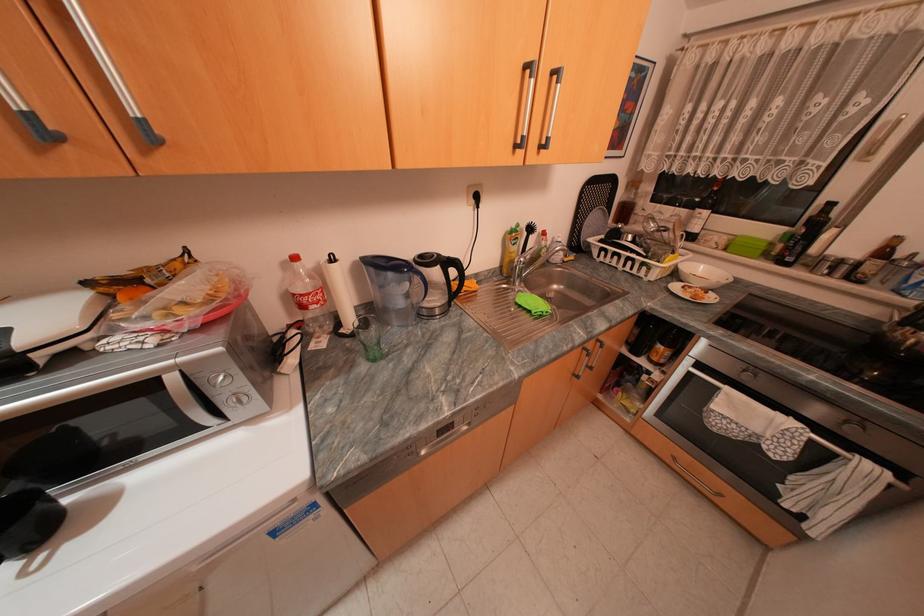
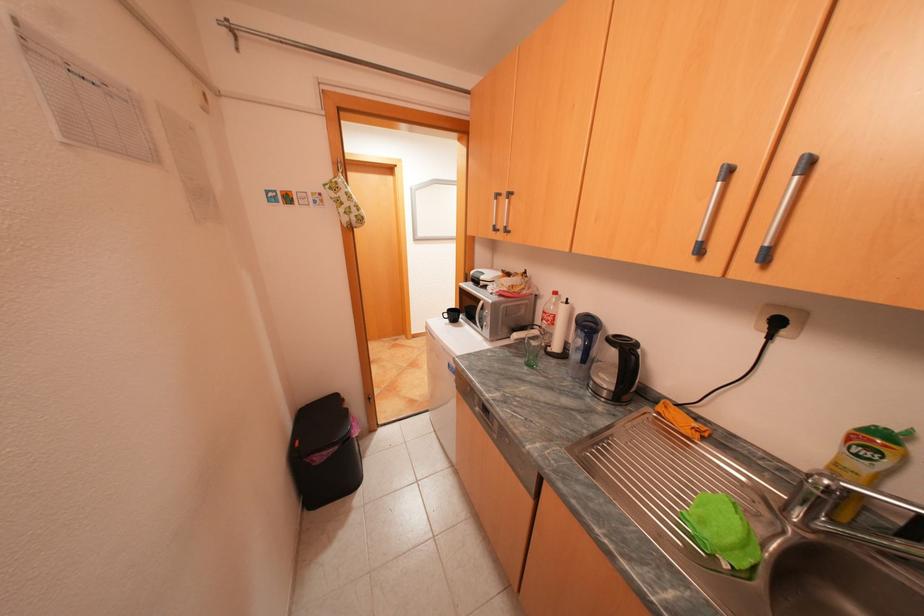
Locate, in the second image, the point that corresponds to the point at 410,302 in the first image.

(586, 355)